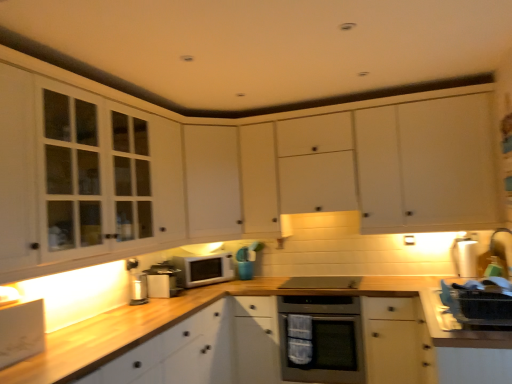
Identify the location of blank space situated above satin black stove at center, the 3th appliance from the left (from a real-world perspective). This screenshot has width=512, height=384. (315, 277).